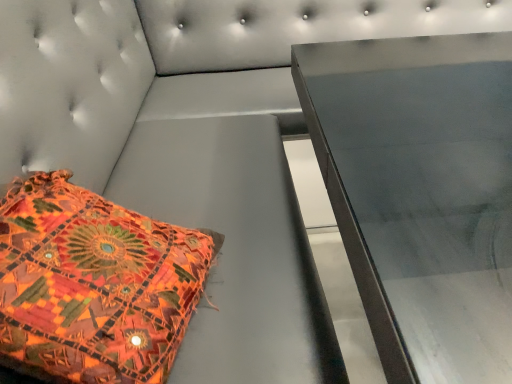
Question: Can you confirm if metallic table at center is positioned to the right of textured fabric pillow at lower left?

Choices:
 (A) no
 (B) yes

Answer: (B)

Question: Considering the relative sizes of metallic table at center and textured fabric pillow at lower left in the image provided, is metallic table at center thinner than textured fabric pillow at lower left?

Choices:
 (A) yes
 (B) no

Answer: (B)

Question: Does metallic table at center have a greater height compared to textured fabric pillow at lower left?

Choices:
 (A) no
 (B) yes

Answer: (B)

Question: Does metallic table at center have a smaller size compared to textured fabric pillow at lower left?

Choices:
 (A) no
 (B) yes

Answer: (A)

Question: Is metallic table at center at the left side of textured fabric pillow at lower left?

Choices:
 (A) yes
 (B) no

Answer: (B)

Question: Is metallic table at center further to camera compared to textured fabric pillow at lower left?

Choices:
 (A) yes
 (B) no

Answer: (A)

Question: Is there a large distance between textured fabric pillow at lower left and metallic table at center?

Choices:
 (A) no
 (B) yes

Answer: (A)

Question: Is textured fabric pillow at lower left beside metallic table at center?

Choices:
 (A) yes
 (B) no

Answer: (B)

Question: Is the depth of textured fabric pillow at lower left greater than that of metallic table at center?

Choices:
 (A) yes
 (B) no

Answer: (B)

Question: Is textured fabric pillow at lower left smaller than metallic table at center?

Choices:
 (A) no
 (B) yes

Answer: (B)

Question: Considering the relative sizes of textured fabric pillow at lower left and metallic table at center in the image provided, is textured fabric pillow at lower left wider than metallic table at center?

Choices:
 (A) no
 (B) yes

Answer: (A)

Question: Does textured fabric pillow at lower left have a larger size compared to metallic table at center?

Choices:
 (A) yes
 (B) no

Answer: (B)

Question: Based on their sizes in the image, would you say textured fabric pillow at lower left is bigger or smaller than metallic table at center?

Choices:
 (A) big
 (B) small

Answer: (B)